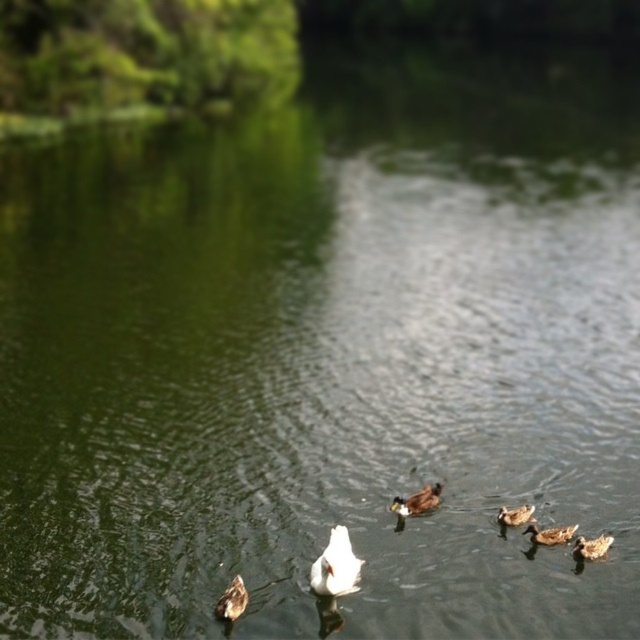
You are a photographer aiming to capture a clear shot of the brown matte duck at lower left and the brown fuzzy duckling at lower right. Which duck will appear closer to the camera in the photo?

The brown matte duck at lower left will appear closer to the camera because it is positioned in front of the brown fuzzy duckling at lower right.

You are observing the ducks in the water. Which duck is closer to the surface of the water, the white feathered duck at center or the brown matte duck at center?

The white feathered duck at center is positioned under brown matte duck at center, so the brown matte duck at center is closer to the surface of the water.